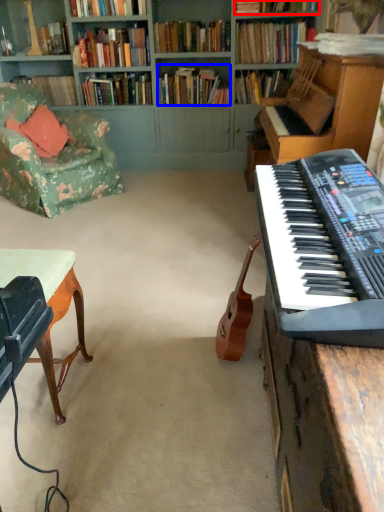
Question: Which object is further to the camera taking this photo, book (highlighted by a red box) or book (highlighted by a blue box)?

Choices:
 (A) book
 (B) book

Answer: (B)